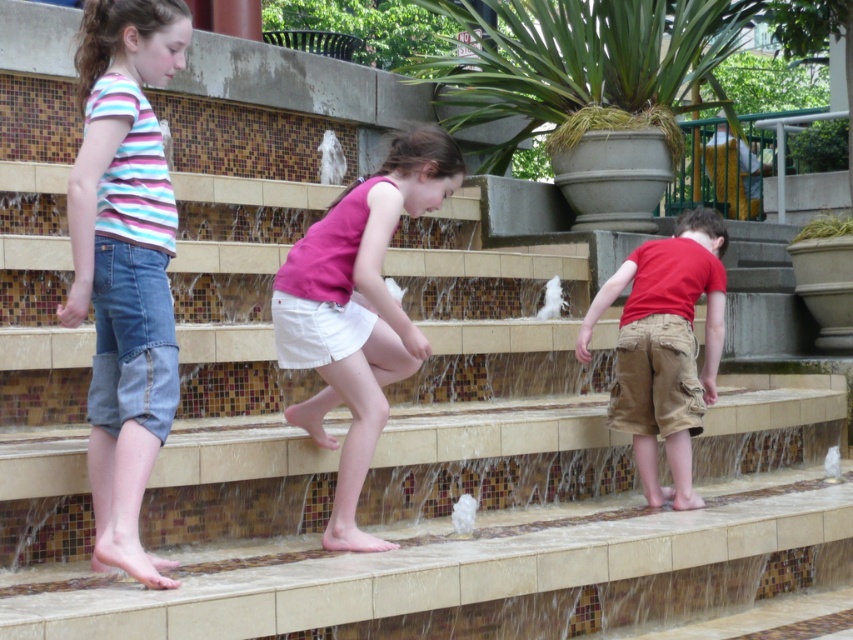
The height and width of the screenshot is (640, 853). What do you see at coordinates (125, 260) in the screenshot?
I see `denim shorts at left` at bounding box center [125, 260].

Between point (122, 556) and point (341, 348), which one is positioned behind?

Point (341, 348)

The width and height of the screenshot is (853, 640). Identify the location of denim shorts at left. (125, 260).

Who is higher up, pink fabric shorts at center or red cotton shirt at lower right?

Positioned higher is pink fabric shorts at center.

At what (x,y) coordinates should I click in order to perform the action: click on pink fabric shorts at center. Please return your answer as a coordinate pair (x, y). The image size is (853, 640). Looking at the image, I should click on (358, 310).

At what (x,y) coordinates should I click in order to perform the action: click on pink fabric shorts at center. Please return your answer as a coordinate pair (x, y). The image size is (853, 640). Looking at the image, I should click on (358, 310).

Is denim shorts at left bigger than red cotton shirt at lower right?

No, denim shorts at left is not bigger than red cotton shirt at lower right.

What do you see at coordinates (125, 260) in the screenshot? The height and width of the screenshot is (640, 853). I see `denim shorts at left` at bounding box center [125, 260].

I want to click on denim shorts at left, so click(125, 260).

I want to click on denim shorts at left, so click(x=125, y=260).